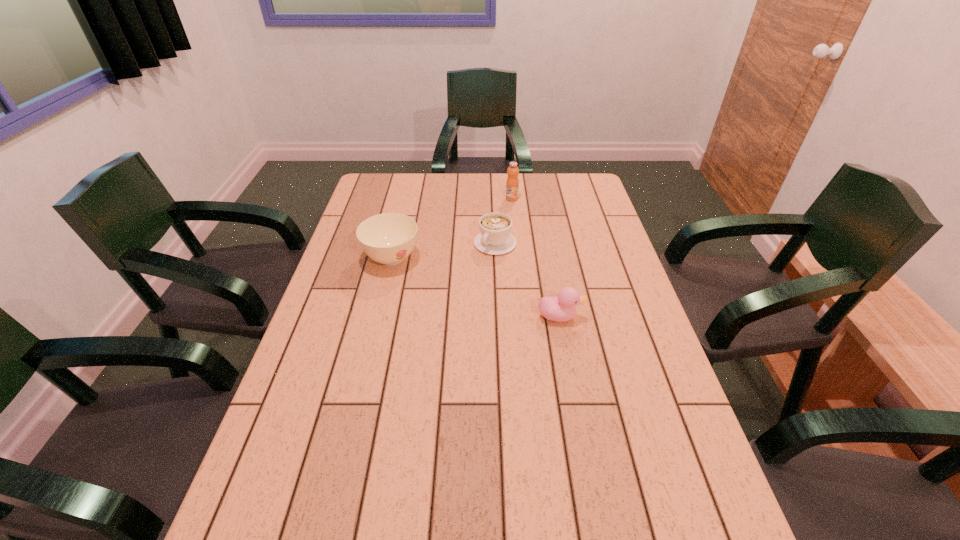
Locate an element on the screen. The width and height of the screenshot is (960, 540). free spot on the desktop that is between the sugar bowl and the duckling and is positioned to the right of the shortest object's handle is located at coordinates (462, 283).

This screenshot has height=540, width=960. I want to click on free space on the desktop that is between the leftmost object and the duckling and is positioned on the front label of the tallest object, so click(446, 278).